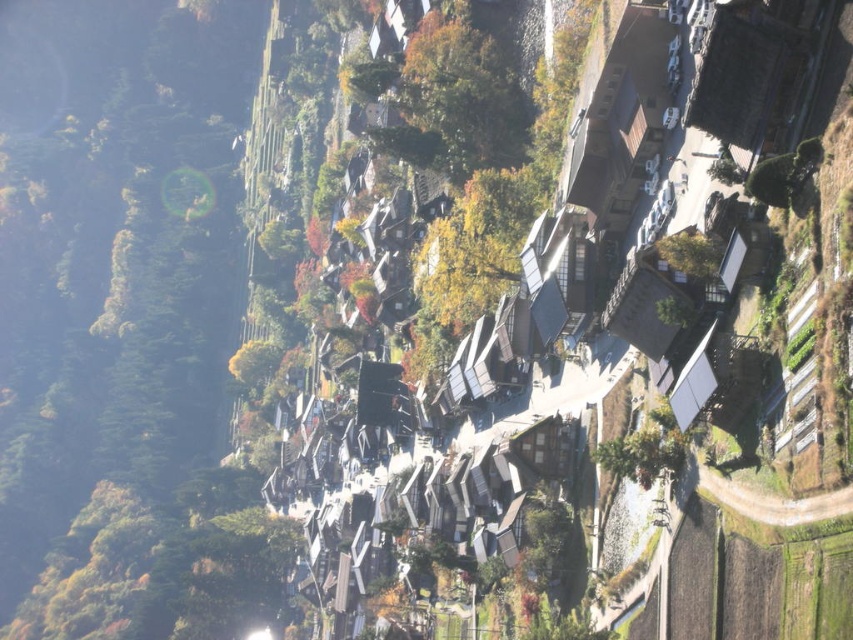
Is point (490, 154) positioned after point (704, 259)?

Yes, it is.

The image size is (853, 640). Describe the element at coordinates (461, 99) in the screenshot. I see `green matte tree at upper center` at that location.

Between point (463, 115) and point (695, 236), which one is positioned in front?

Point (695, 236) is in front.

Find the location of a particular element. The height and width of the screenshot is (640, 853). green matte tree at upper center is located at coordinates (461, 99).